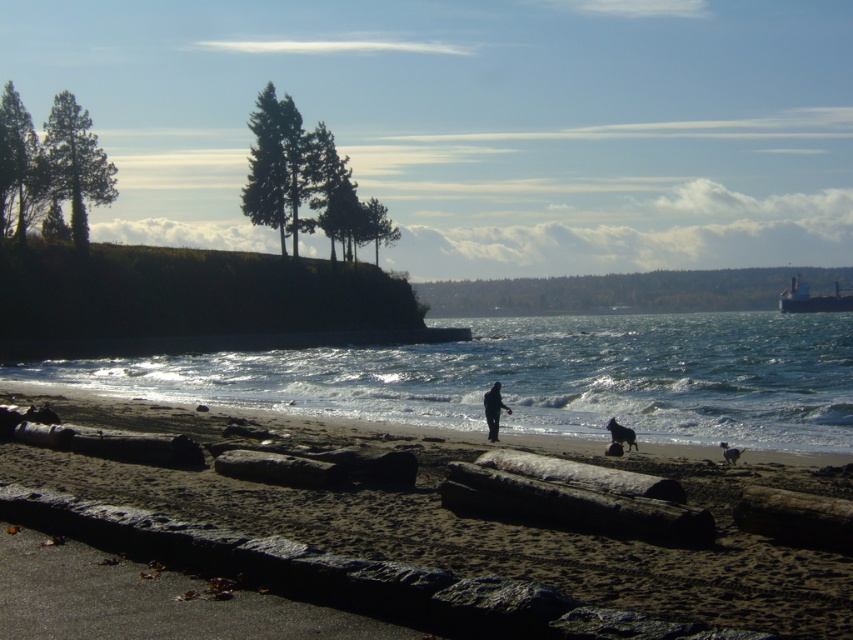
You are standing on the beach and want to walk towards the metallic gray ship at upper right. Which direction should you head relative to the dark brown sand at center?

To reach the metallic gray ship at upper right, you should head to the right of the dark brown sand at center since the metallic gray ship at upper right is located to the right of the dark brown sand at center.

You are a photographer planning to capture the coastal scene. You want to ensure the clear water at center and dark brown sand at center are both visible in your shot. Given that your camera frame can only accommodate one of them fully, which one should you prioritize to fit within the frame based on their widths?

The clear water at center has a greater width than the dark brown sand at center, so you should prioritize capturing the clear water at center to ensure it fits within the frame.

You are a photographer trying to capture the black matte dog at lower center and the dark brown sand at center in a single shot. Since the sand is larger, will you need to adjust your camera angle to include both?

The dark brown sand at center has a larger size compared to the black matte dog at lower center. To include both in the shot, you should widen your camera angle to accommodate the larger sand area.